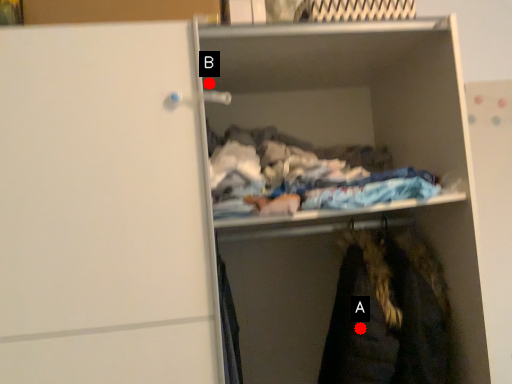
Question: Two points are circled on the image, labeled by A and B beside each circle. Which point is farther to the camera?

Choices:
 (A) A is further
 (B) B is further

Answer: (B)